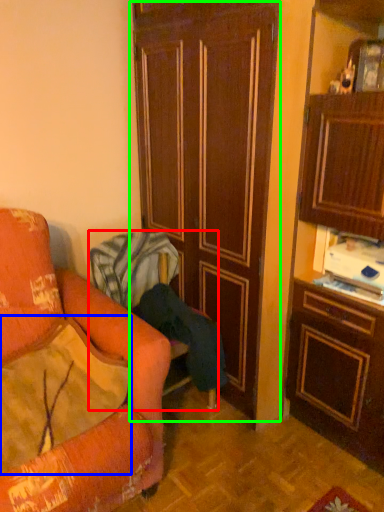
Question: Based on their relative distances, which object is farther from chair (highlighted by a red box)? Choose from pillow (highlighted by a blue box) and door (highlighted by a green box).

Choices:
 (A) pillow
 (B) door

Answer: (A)